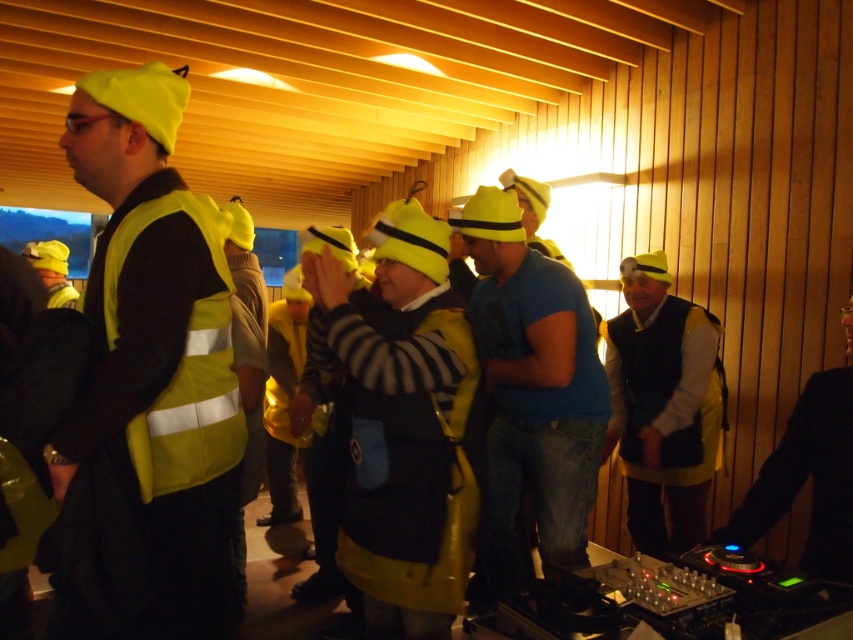
Does yellow fabric backpack at center appear over blue cotton t-shirt at center?

Indeed, yellow fabric backpack at center is positioned over blue cotton t-shirt at center.

Is yellow fabric backpack at center bigger than blue cotton t-shirt at center?

Yes, yellow fabric backpack at center is bigger than blue cotton t-shirt at center.

Is point (403, 602) behind point (593, 406)?

No, (403, 602) is closer to viewer.

I want to click on yellow fabric backpack at center, so click(x=399, y=420).

Which is in front, point (544, 484) or point (117, 323)?

Point (117, 323)

Which of these two, blue cotton t-shirt at center or yellow reflective safety vest at left, stands taller?

blue cotton t-shirt at center

The height and width of the screenshot is (640, 853). Find the location of `blue cotton t-shirt at center`. blue cotton t-shirt at center is located at coordinates (532, 392).

Does point (556, 568) come in front of point (622, 330)?

Yes, it is in front of point (622, 330).

Find the location of `blue cotton t-shirt at center`. blue cotton t-shirt at center is located at coordinates (532, 392).

Which is behind, point (560, 452) or point (624, 472)?

The point (624, 472) is behind.

Where is `blue cotton t-shirt at center`? The width and height of the screenshot is (853, 640). blue cotton t-shirt at center is located at coordinates (532, 392).